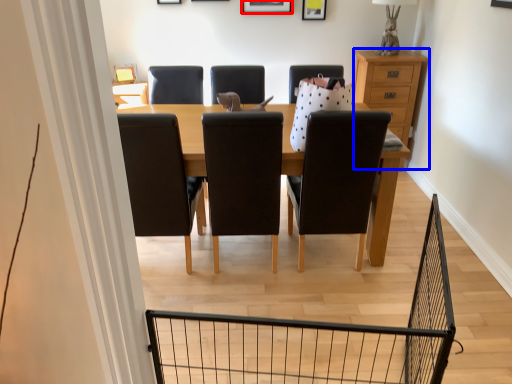
Question: Among these objects, which one is farthest to the camera, picture frame (highlighted by a red box) or chest of drawers (highlighted by a blue box)?

Choices:
 (A) picture frame
 (B) chest of drawers

Answer: (A)